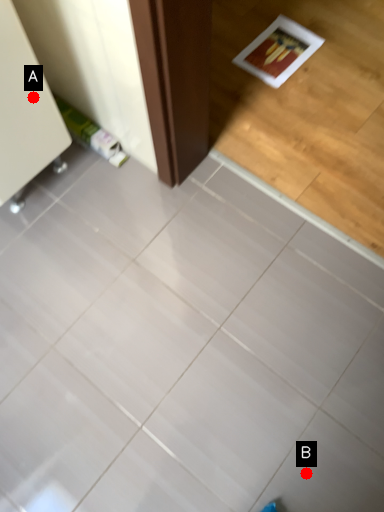
Question: Two points are circled on the image, labeled by A and B beside each circle. Which of the following is the farthest from the observer?

Choices:
 (A) A is further
 (B) B is further

Answer: (A)